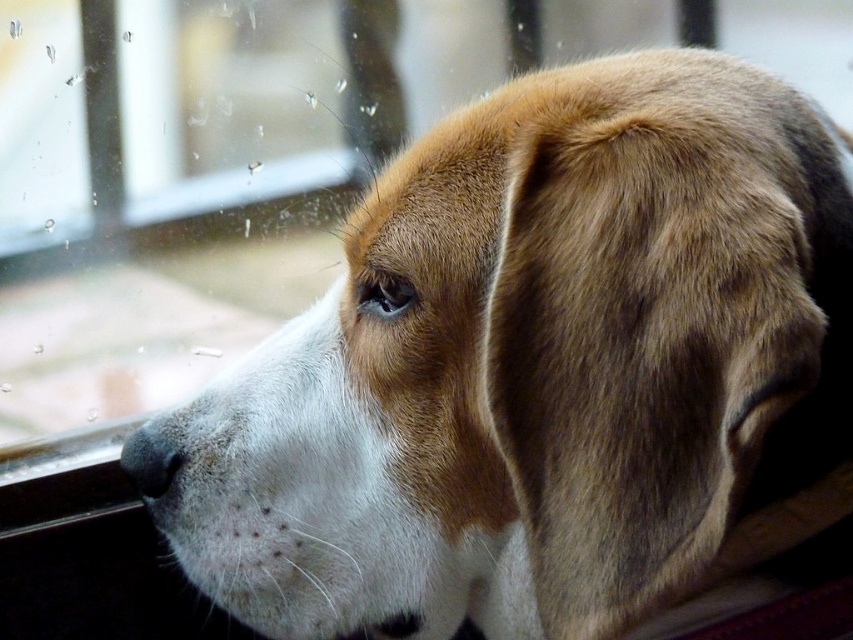
Does black plastic window sill at lower left have a greater height compared to black matte nose at lower left?

Yes.

In the scene shown: Which of these two, black plastic window sill at lower left or black matte nose at lower left, stands shorter?

black matte nose at lower left is shorter.

Locate an element on the screen. The width and height of the screenshot is (853, 640). black plastic window sill at lower left is located at coordinates [62, 477].